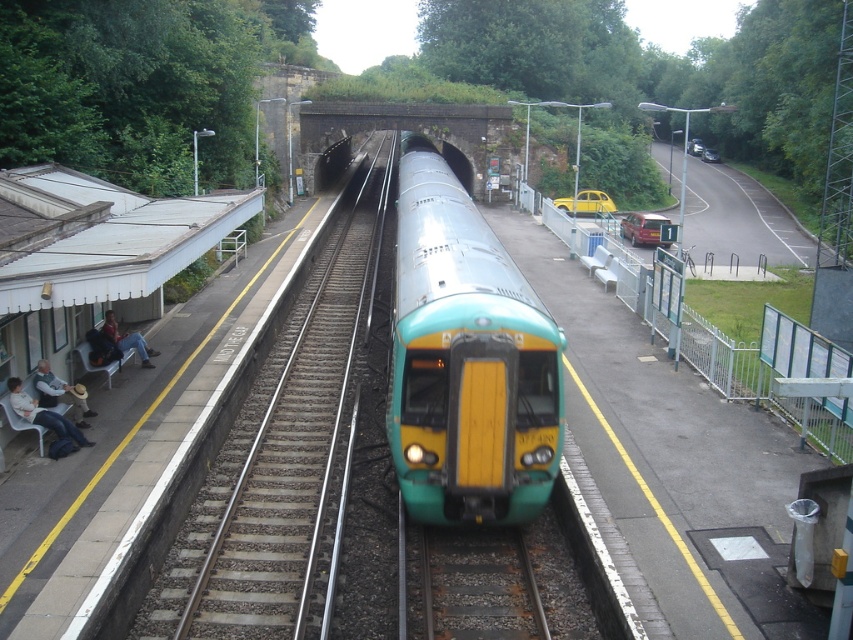
You are a pedestrian standing on the platform and want to cross the tracks to reach the road. The teal glossy passenger train at center and the denim jacket at left are in your path. Which object is closer to you, the pedestrian, so you need to avoid it first?

The denim jacket at left is closer to you because the teal glossy passenger train at center is positioned on the right side of it, meaning the denim jacket at left is between you and the train.